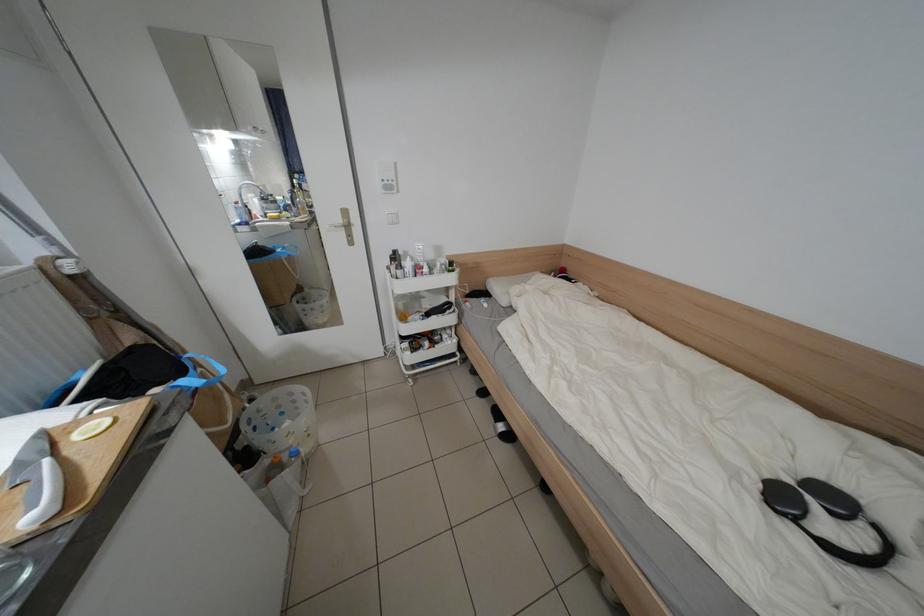
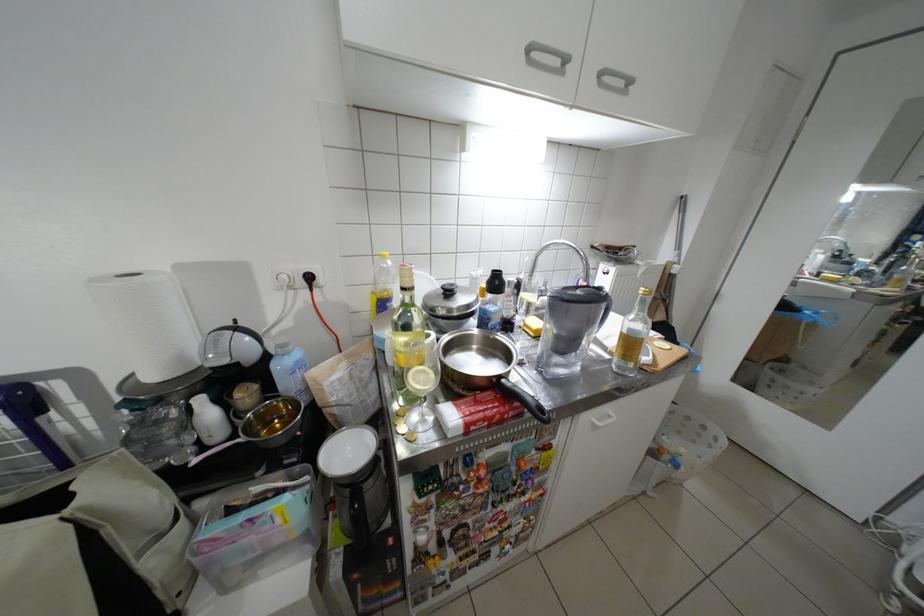
Based on the continuous images, in which direction is the camera rotating?

The rotation direction of the camera is left-down.